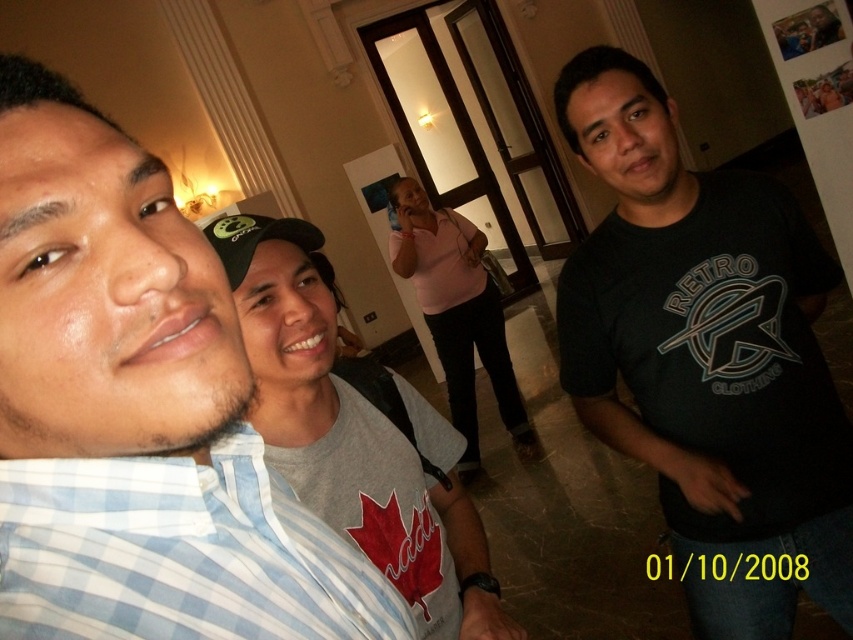
Is blue plaid shirt at left shorter than pink fabric shirt at center?

Yes.

Is blue plaid shirt at left taller than pink fabric shirt at center?

Incorrect, blue plaid shirt at left's height is not larger of pink fabric shirt at center's.

This screenshot has width=853, height=640. Identify the location of blue plaid shirt at left. (138, 412).

Who is lower down, black matte shirt at center or blue and white checkered shirt at left?

Positioned lower is blue and white checkered shirt at left.

Is black matte shirt at center in front of blue and white checkered shirt at left?

No.

Consider the image. Who is more distant from viewer, (645, 83) or (312, 536)?

Point (645, 83)

At what (x,y) coordinates should I click in order to perform the action: click on black matte shirt at center. Please return your answer as a coordinate pair (x, y). The width and height of the screenshot is (853, 640). Looking at the image, I should click on (706, 355).

Consider the image. Is blue plaid shirt at left behind black matte shirt at center?

No, it is in front of black matte shirt at center.

Based on the photo, is blue plaid shirt at left to the left of black matte shirt at center from the viewer's perspective?

Yes, blue plaid shirt at left is to the left of black matte shirt at center.

At what (x,y) coordinates should I click in order to perform the action: click on blue plaid shirt at left. Please return your answer as a coordinate pair (x, y). The height and width of the screenshot is (640, 853). Looking at the image, I should click on (138, 412).